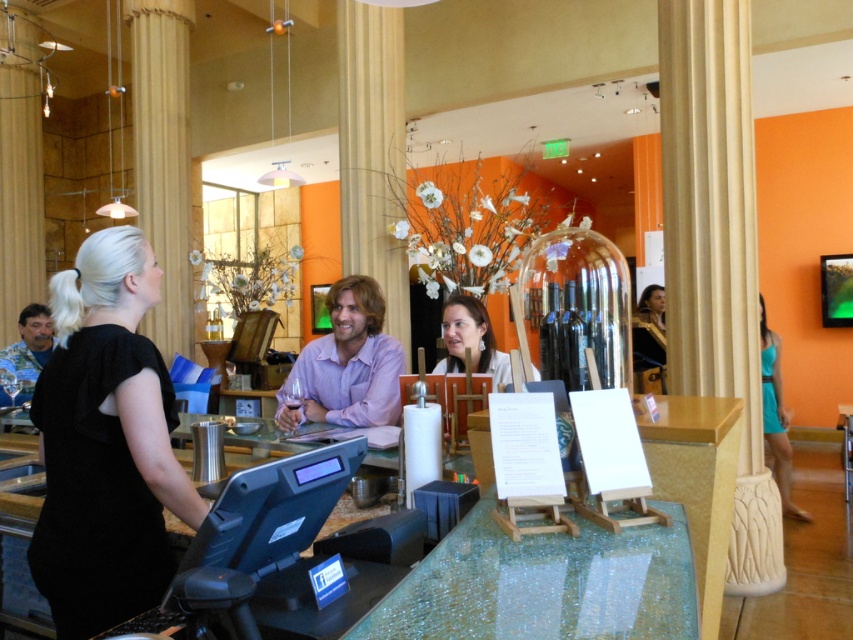
You are a customer at the wine bar and want to order a drink. You see the black matte dress at left and the purple cotton shirt at center. Which clothing item is closer to the counter where you can place your order?

The black matte dress at left is positioned on the left side of the purple cotton shirt at center, so the black matte dress at left is closer to the counter where you can place your order.

You are a customer at the wine bar and want to choose a dress to wear to an upcoming event. The black matte dress at left and the teal fabric dress at right are both available. Which dress has a larger size?

The teal fabric dress at right is larger than the black matte dress at left, so it has a larger size.

You are a fashion designer observing the black matte dress at left and the purple cotton shirt at center. Which clothing item is wider?

The black matte dress at left is wider than the purple cotton shirt at center.